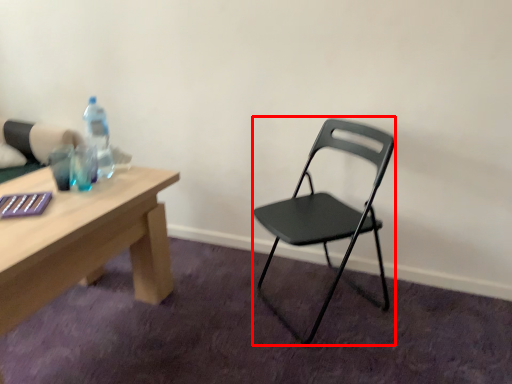
Question: Observing the image, what is the correct spatial positioning of chair (annotated by the red box) in reference to bottle?

Choices:
 (A) left
 (B) right

Answer: (B)